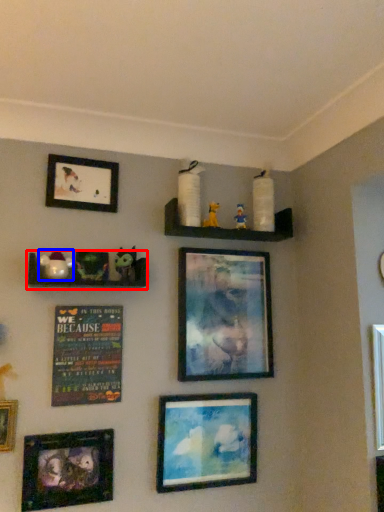
Question: Among these objects, which one is nearest to the camera, shelf (highlighted by a red box) or toy (highlighted by a blue box)?

Choices:
 (A) shelf
 (B) toy

Answer: (A)